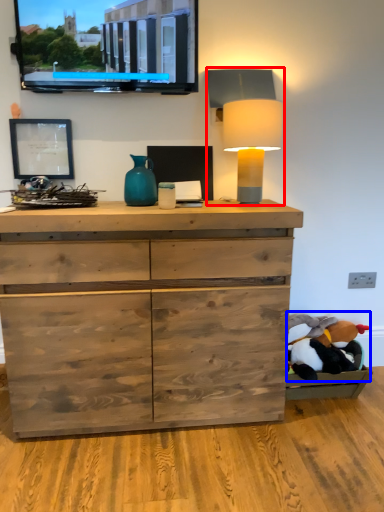
Question: Which object appears farthest to the camera in this image, table lamp (highlighted by a red box) or animal (highlighted by a blue box)?

Choices:
 (A) table lamp
 (B) animal

Answer: (B)